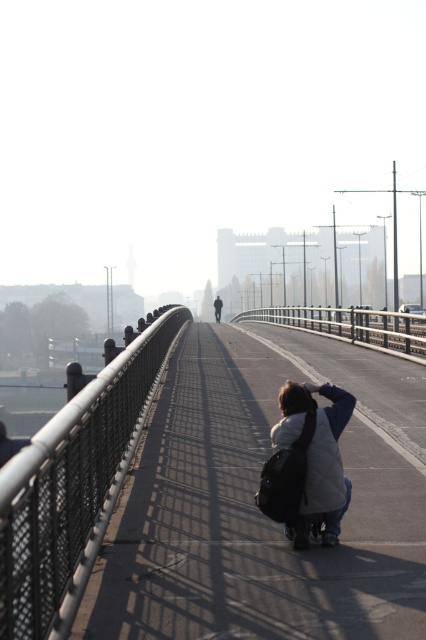
Question: Which is nearer to the white matte jacket at lower center?

Choices:
 (A) black metal rail at center
 (B) black mesh fence at center
 (C) metallic bridge at center

Answer: (B)

Question: Which of the following is the farthest from the observer?

Choices:
 (A) (0, 525)
 (B) (273, 317)
 (C) (284, 433)
 (D) (412, 627)

Answer: (B)

Question: Among these points, which one is farthest from the camera?

Choices:
 (A) [331, 516]
 (B) [54, 490]
 (C) [285, 312]

Answer: (C)

Question: Where is metallic bridge at center located in relation to white matte jacket at lower center in the image?

Choices:
 (A) below
 (B) above

Answer: (B)

Question: Can you confirm if metallic bridge at center is positioned above black metal rail at center?

Choices:
 (A) yes
 (B) no

Answer: (B)

Question: Is metallic bridge at center to the left of black metal rail at center from the viewer's perspective?

Choices:
 (A) yes
 (B) no

Answer: (A)